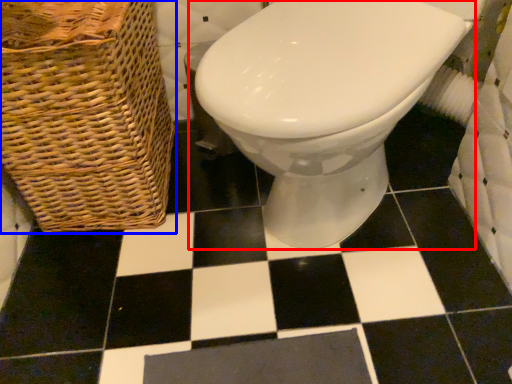
Question: Among these objects, which one is farthest to the camera, toilet (highlighted by a red box) or basket (highlighted by a blue box)?

Choices:
 (A) toilet
 (B) basket

Answer: (B)